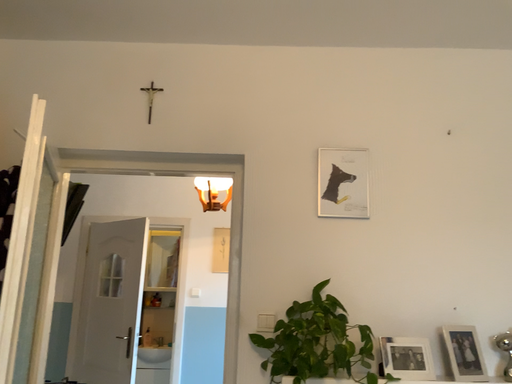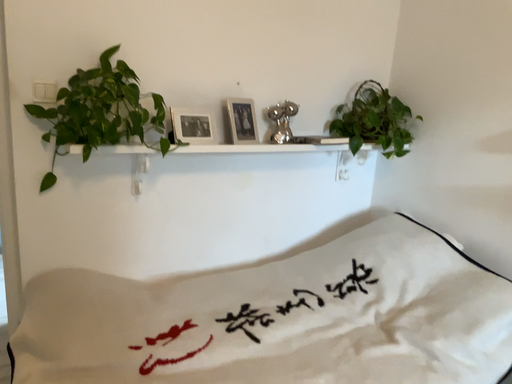
Question: Which way did the camera rotate in the video?

Choices:
 (A) rotated downward
 (B) rotated upward

Answer: (A)